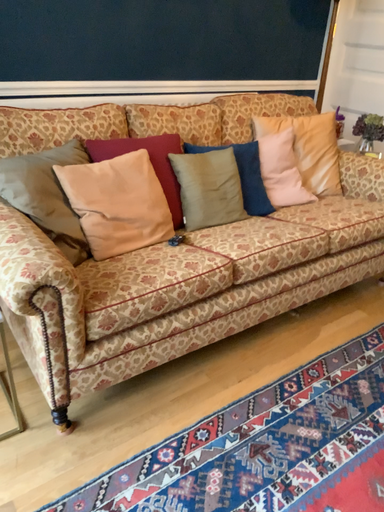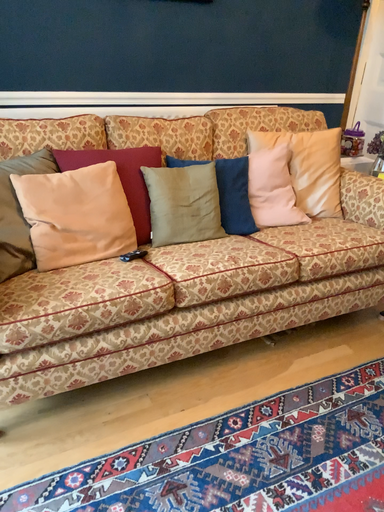
Question: Which way did the camera rotate in the video?

Choices:
 (A) rotated right
 (B) rotated left

Answer: (B)